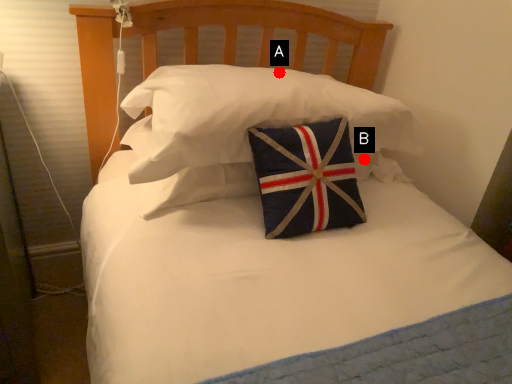
Question: Two points are circled on the image, labeled by A and B beside each circle. Which point appears closest to the camera in this image?

Choices:
 (A) A is closer
 (B) B is closer

Answer: (A)